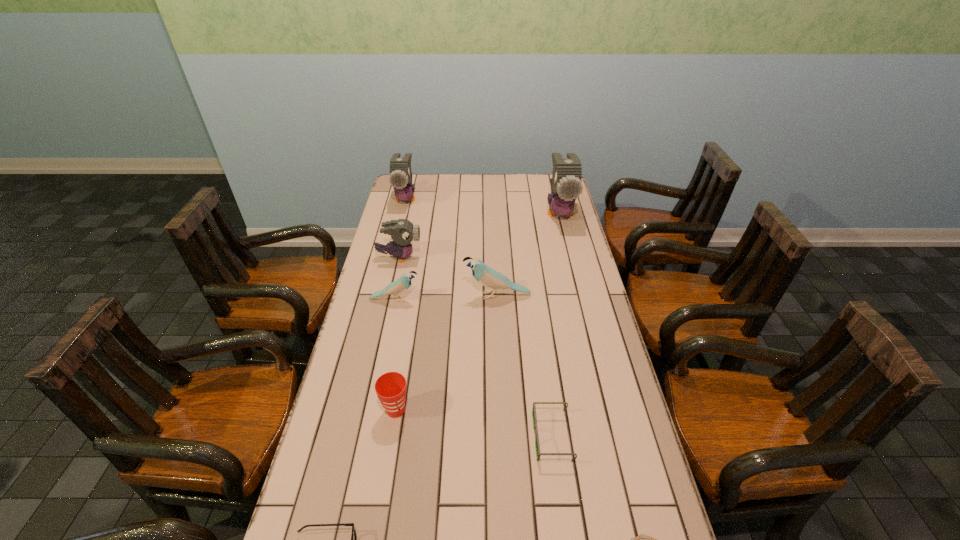
Where is `bird object that ranks as the third closest to the rightmost gray bird`? Image resolution: width=960 pixels, height=540 pixels. bird object that ranks as the third closest to the rightmost gray bird is located at coordinates (400, 178).

Locate which gray bird is the second closest to the shortest object. Please provide its 2D coordinates. Your answer should be formatted as a tuple, i.e. [(x, y)], where the tuple contains the x and y coordinates of a point satisfying the conditions above.

[(566, 185)]

The image size is (960, 540). Identify the location of gray bird that is the second closest to the rightmost bird. (400, 178).

Locate an element on the screen. Image resolution: width=960 pixels, height=540 pixels. vacant position in the image that satisfies the following two spatial constraints: 1. at the beak of the tallest object; 2. on the lens of the black spectacles is located at coordinates (x=614, y=437).

Where is `free spot that satisfies the following two spatial constraints: 1. at the face of the cup; 2. on the right side of the left blue bird`? The image size is (960, 540). free spot that satisfies the following two spatial constraints: 1. at the face of the cup; 2. on the right side of the left blue bird is located at coordinates click(372, 410).